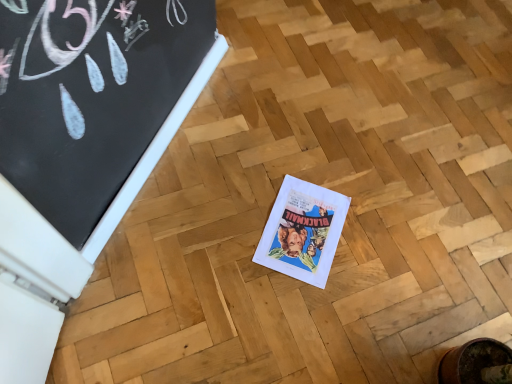
Question: Considering the positions of point (267, 256) and point (58, 134), is point (267, 256) closer or farther from the camera than point (58, 134)?

Choices:
 (A) closer
 (B) farther

Answer: (B)

Question: From a real-world perspective, is white paper comic book at center physically located above or below black chalkboard at upper left?

Choices:
 (A) below
 (B) above

Answer: (A)

Question: Considering their positions, is white paper comic book at center located in front of or behind black chalkboard at upper left?

Choices:
 (A) front
 (B) behind

Answer: (B)

Question: Considering the positions of black chalkboard at upper left and white paper comic book at center in the image, is black chalkboard at upper left wider or thinner than white paper comic book at center?

Choices:
 (A) wide
 (B) thin

Answer: (B)

Question: From a real-world perspective, is black chalkboard at upper left positioned above or below white paper comic book at center?

Choices:
 (A) below
 (B) above

Answer: (B)

Question: Is black chalkboard at upper left situated inside white paper comic book at center or outside?

Choices:
 (A) outside
 (B) inside

Answer: (A)

Question: Considering the positions of point [x=135, y=67] and point [x=329, y=192], is point [x=135, y=67] closer or farther from the camera than point [x=329, y=192]?

Choices:
 (A) closer
 (B) farther

Answer: (A)